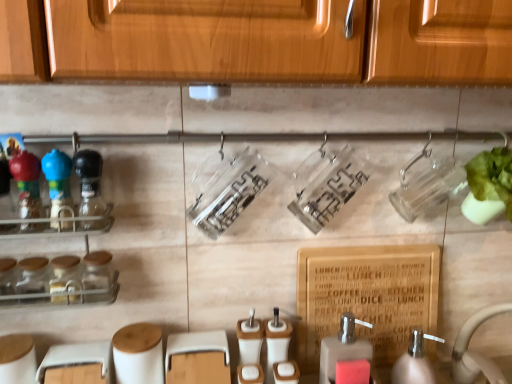
Question: Should I look upward or downward to see matte brown soap dispenser at lower center, which is counted as the first soap dispenser, starting from the left?

Choices:
 (A) down
 (B) up

Answer: (A)

Question: Considering the relative sizes of clear glass spice rack at left and green leafy vegetable at right in the image provided, is clear glass spice rack at left smaller than green leafy vegetable at right?

Choices:
 (A) no
 (B) yes

Answer: (A)

Question: Can you confirm if clear glass spice rack at left is shorter than green leafy vegetable at right?

Choices:
 (A) yes
 (B) no

Answer: (B)

Question: Is clear glass spice rack at left taller than green leafy vegetable at right?

Choices:
 (A) no
 (B) yes

Answer: (B)

Question: Is clear glass spice rack at left next to green leafy vegetable at right?

Choices:
 (A) yes
 (B) no

Answer: (B)

Question: From the image's perspective, does clear glass spice rack at left appear higher than green leafy vegetable at right?

Choices:
 (A) no
 (B) yes

Answer: (A)

Question: Does clear glass spice rack at left appear on the left side of green leafy vegetable at right?

Choices:
 (A) yes
 (B) no

Answer: (A)

Question: Is clear plastic container at center, which is counted as the 1th bottle, starting from the right, smaller than white ceramic sink at lower right?

Choices:
 (A) no
 (B) yes

Answer: (B)

Question: Does clear plastic container at center, marked as the 3th bottle in a left-to-right arrangement, have a lesser height compared to white ceramic sink at lower right?

Choices:
 (A) yes
 (B) no

Answer: (A)

Question: Considering the relative sizes of clear plastic container at center, which is counted as the 1th bottle, starting from the right, and white ceramic sink at lower right in the image provided, is clear plastic container at center, which is counted as the 1th bottle, starting from the right, thinner than white ceramic sink at lower right?

Choices:
 (A) yes
 (B) no

Answer: (A)

Question: Is clear plastic container at center, which is counted as the 1th bottle, starting from the right, to the left of white ceramic sink at lower right from the viewer's perspective?

Choices:
 (A) yes
 (B) no

Answer: (A)

Question: From the image's perspective, would you say clear plastic container at center, which is counted as the 1th bottle, starting from the right, is positioned over white ceramic sink at lower right?

Choices:
 (A) no
 (B) yes

Answer: (B)

Question: Is white ceramic sink at lower right surrounded by clear plastic container at center, which is counted as the 1th bottle, starting from the right?

Choices:
 (A) yes
 (B) no

Answer: (B)

Question: From a real-world perspective, is white ceramic sink at lower right below clear glass spice rack at left?

Choices:
 (A) yes
 (B) no

Answer: (A)